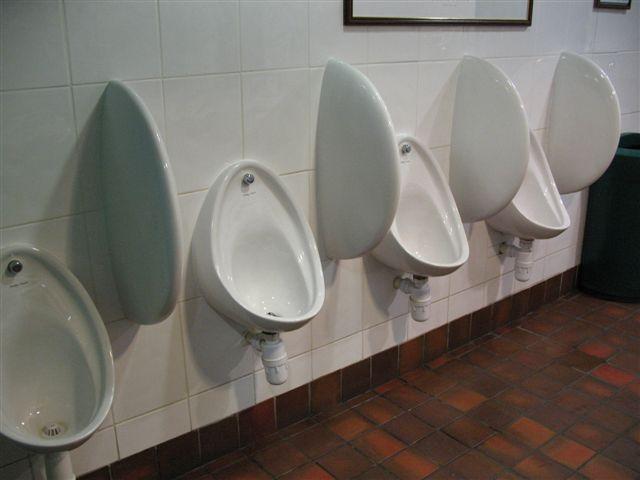
The image size is (640, 480). In order to click on frame for small picture in this screenshot , I will do `click(612, 3)`.